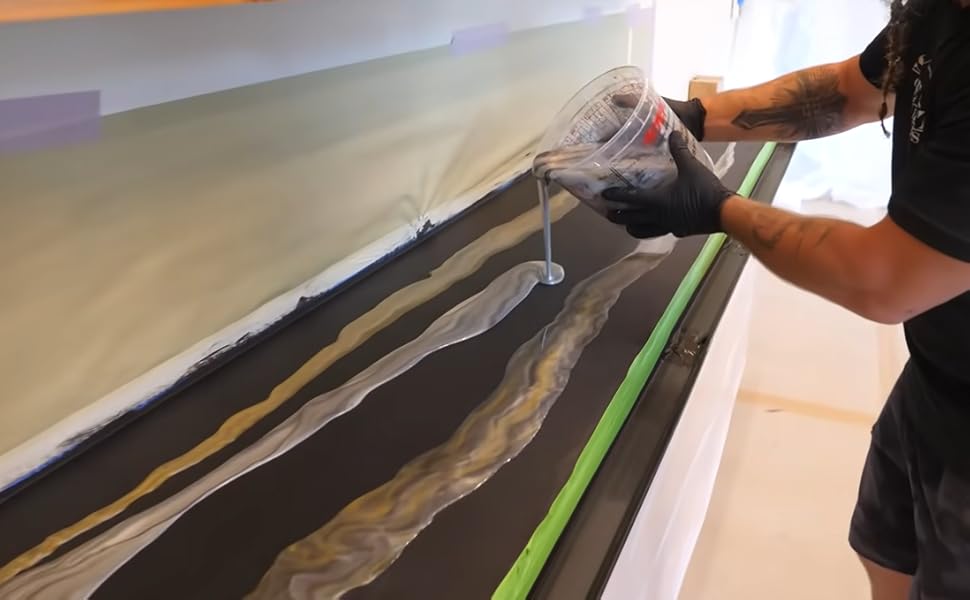
Locate an element on the screen. wall is located at coordinates (127, 96).